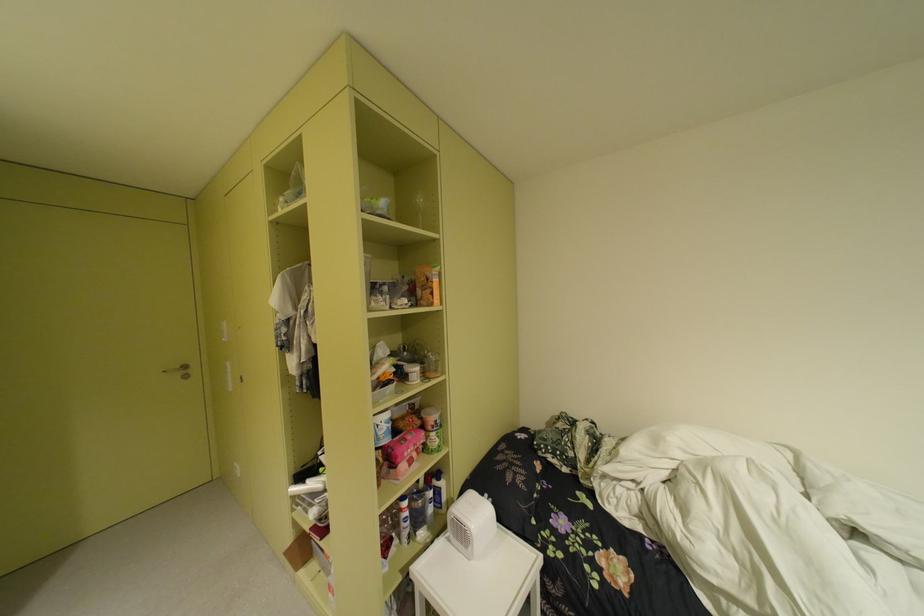
Find where to lift the clear plastic container. Please return your answer as a coordinate pair (x, y).

(432, 365)